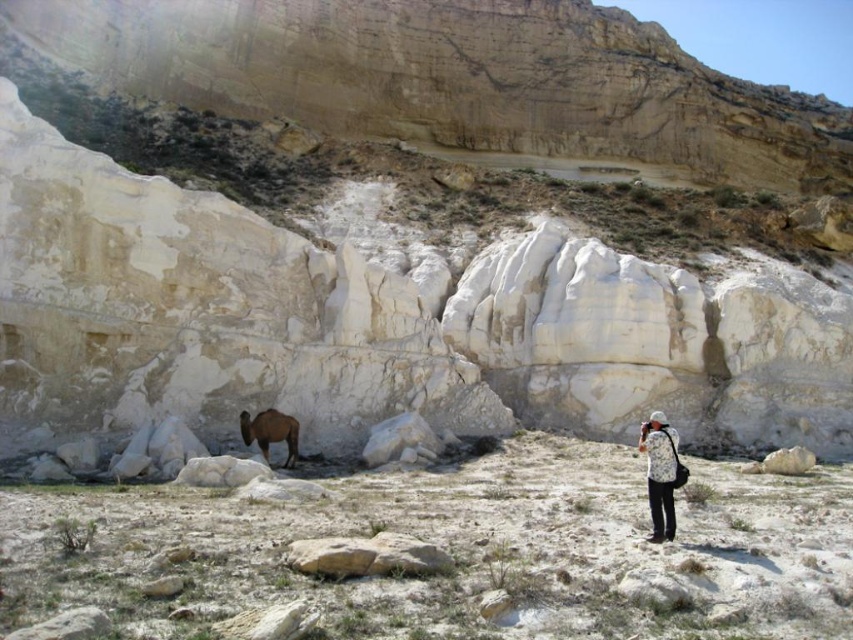
Question: Can you confirm if floral-patterned fabric at lower right is positioned to the right of brown fuzzy camel at lower left?

Choices:
 (A) no
 (B) yes

Answer: (B)

Question: Is floral-patterned fabric at lower right to the left of brown fuzzy camel at lower left from the viewer's perspective?

Choices:
 (A) yes
 (B) no

Answer: (B)

Question: Which object is closer to the camera taking this photo?

Choices:
 (A) floral-patterned fabric at lower right
 (B) brown dirt at center
 (C) brown fuzzy camel at lower left

Answer: (B)

Question: Does brown dirt at center appear over brown fuzzy camel at lower left?

Choices:
 (A) yes
 (B) no

Answer: (B)

Question: Which point appears farthest from the camera in this image?

Choices:
 (A) (651, 449)
 (B) (258, 444)

Answer: (B)

Question: Among these objects, which one is farthest from the camera?

Choices:
 (A) brown fuzzy camel at lower left
 (B) brown dirt at center

Answer: (A)